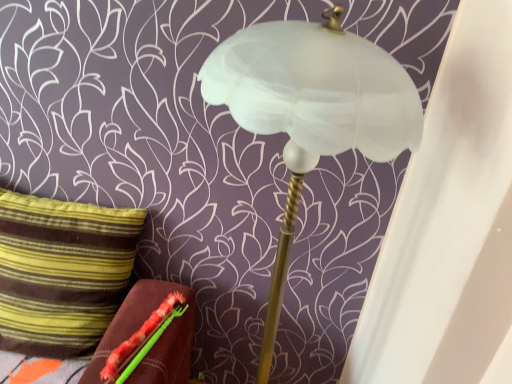
Question: From the image's perspective, is green fuzzy brush at lower left positioned above or below white frosted glass lamp at center?

Choices:
 (A) above
 (B) below

Answer: (B)

Question: Based on their positions, is green fuzzy brush at lower left located to the left or right of white frosted glass lamp at center?

Choices:
 (A) left
 (B) right

Answer: (A)

Question: Considering the real-world distances, which object is farthest from the green fuzzy brush at lower left?

Choices:
 (A) white frosted glass lamp at center
 (B) striped fabric pillow at left

Answer: (A)

Question: Estimate the real-world distances between objects in this image. Which object is farther from the striped fabric pillow at left?

Choices:
 (A) white frosted glass lamp at center
 (B) green fuzzy brush at lower left

Answer: (A)